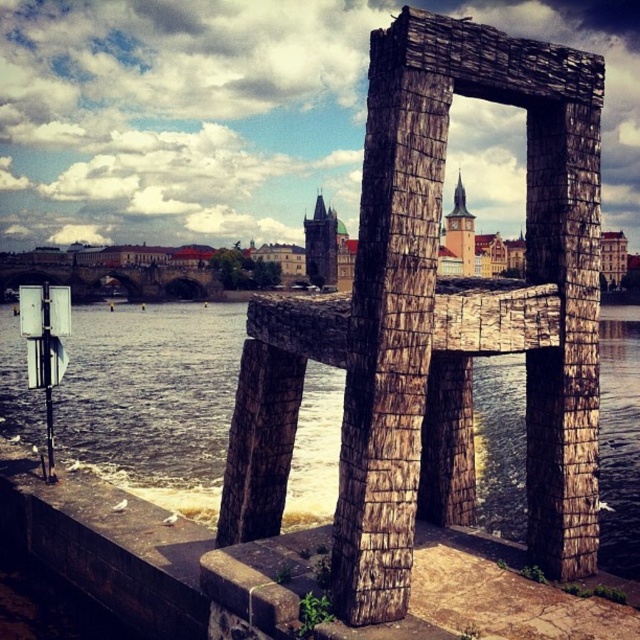
Question: Does wooden chair at center have a greater width compared to brown stone water at center?

Choices:
 (A) no
 (B) yes

Answer: (A)

Question: Where is wooden chair at center located in relation to brown stone water at center in the image?

Choices:
 (A) below
 (B) above

Answer: (A)

Question: Which point is farther to the camera?

Choices:
 (A) wooden chair at center
 (B) brown stone water at center

Answer: (B)

Question: Is wooden chair at center to the right of brown stone water at center from the viewer's perspective?

Choices:
 (A) no
 (B) yes

Answer: (A)

Question: Which object appears farthest from the camera in this image?

Choices:
 (A) wooden chair at center
 (B) brown stone water at center

Answer: (B)

Question: Which of the following is the farthest from the observer?

Choices:
 (A) (108, 356)
 (B) (365, 486)

Answer: (A)